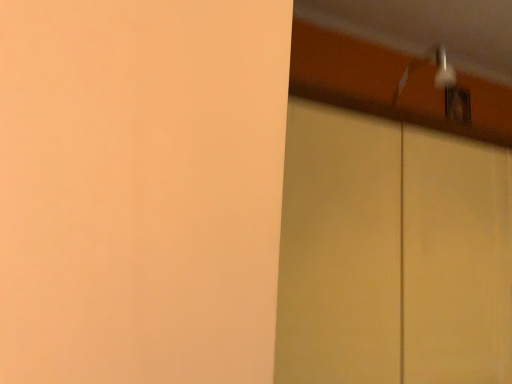
Measure the distance between point (387, 264) and camera.

The distance of point (387, 264) from camera is 1.08 meters.

I want to click on white matte door at center, so click(x=392, y=254).

Describe the element at coordinates (392, 254) in the screenshot. The image size is (512, 384). I see `white matte door at center` at that location.

This screenshot has width=512, height=384. Find the location of `white matte door at center`. white matte door at center is located at coordinates (392, 254).